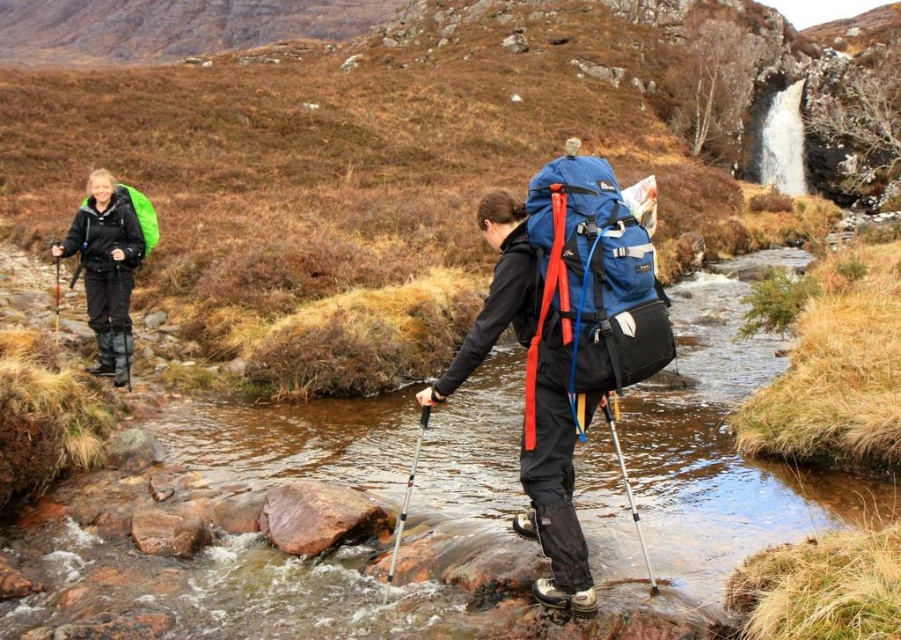
You are a hiker planning to cross the stream. You see the matte black jacket at left and the green matte backpack at left. Which object is taller?

The matte black jacket at left is taller than the green matte backpack at left.

You are a hiker trying to locate your blue fabric backpack at center. Where would you look relative to the point marked at coordinates (x=593, y=282)?

The point marked at coordinates (x=593, y=282) is on the blue fabric backpack at center, so you should look directly at that point to find your backpack.